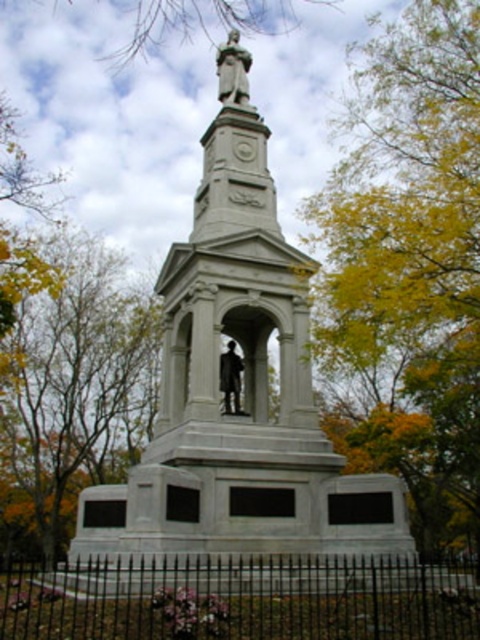
Is white marble statue at center taller than yellow leafy tree at upper center?

Incorrect, white marble statue at center's height is not larger of yellow leafy tree at upper center's.

Can you confirm if white marble statue at center is positioned below yellow leafy tree at upper center?

Yes, white marble statue at center is below yellow leafy tree at upper center.

Which is behind, point (377, 547) or point (409, 136)?

The point (409, 136) is behind.

The width and height of the screenshot is (480, 640). I want to click on white marble statue at center, so click(x=238, y=419).

Does yellow leafy tree at center have a lesser height compared to polished bronze statue at upper center?

Incorrect, yellow leafy tree at center's height does not fall short of polished bronze statue at upper center's.

Is yellow leafy tree at center closer to the viewer compared to polished bronze statue at upper center?

No, yellow leafy tree at center is further to the viewer.

Does point (148, 403) come behind point (249, 99)?

Yes.

The image size is (480, 640). In order to click on yellow leafy tree at center in this screenshot , I will do `click(72, 394)`.

Does white marble statue at center have a greater width compared to polished bronze statue at center?

Indeed, white marble statue at center has a greater width compared to polished bronze statue at center.

Can you confirm if white marble statue at center is positioned to the right of polished bronze statue at center?

Indeed, white marble statue at center is positioned on the right side of polished bronze statue at center.

Is point (314, 564) closer to camera compared to point (224, 392)?

Yes, it is in front of point (224, 392).

Where is `white marble statue at center`? Image resolution: width=480 pixels, height=640 pixels. white marble statue at center is located at coordinates (238, 419).